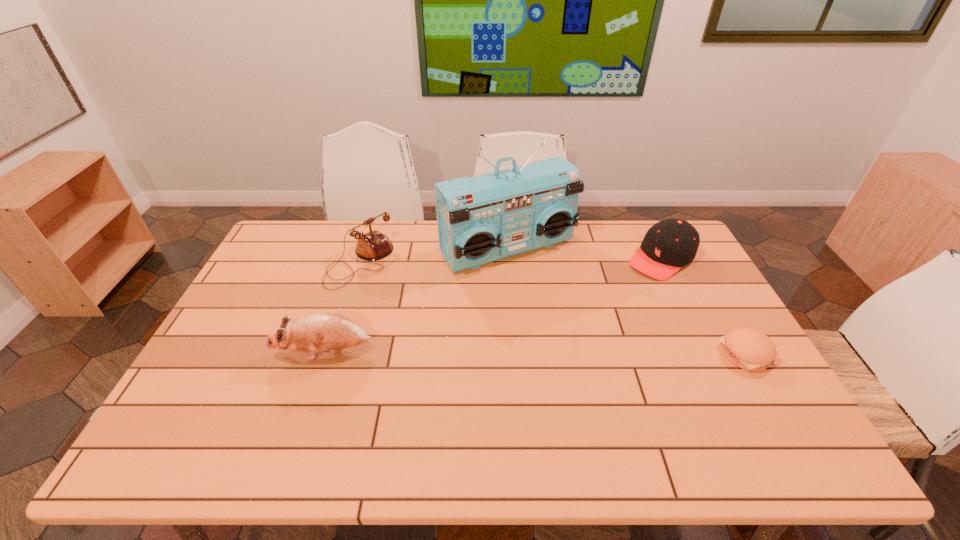
Locate an element on the screen. This screenshot has height=540, width=960. object that can be found as the third closest to the cap is located at coordinates (372, 246).